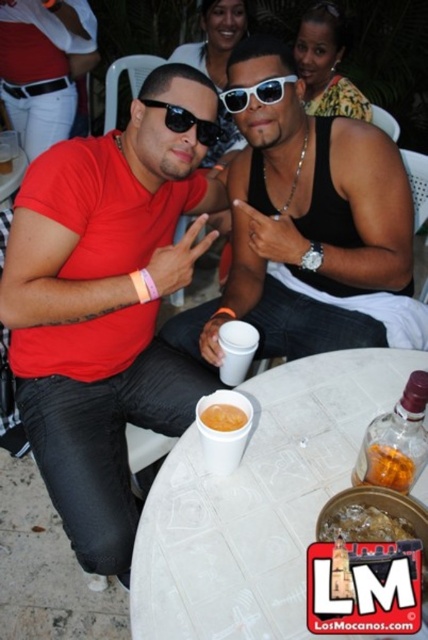
What object is located at the coordinate point (258, 502) in the image?

The point (258, 502) corresponds to the white tile table at center.

You are standing at the edge of the gathering and want to take a photo of the man on the left. The camera you have can only focus on objects within 1 meter. Is the point at coordinates point (205, 604) within the camera focus range?

The point at coordinates point (205, 604) is 75.51 centimeters from the viewer, which is within the camera focus range of 1 meter. Therefore, the camera can focus on that point.